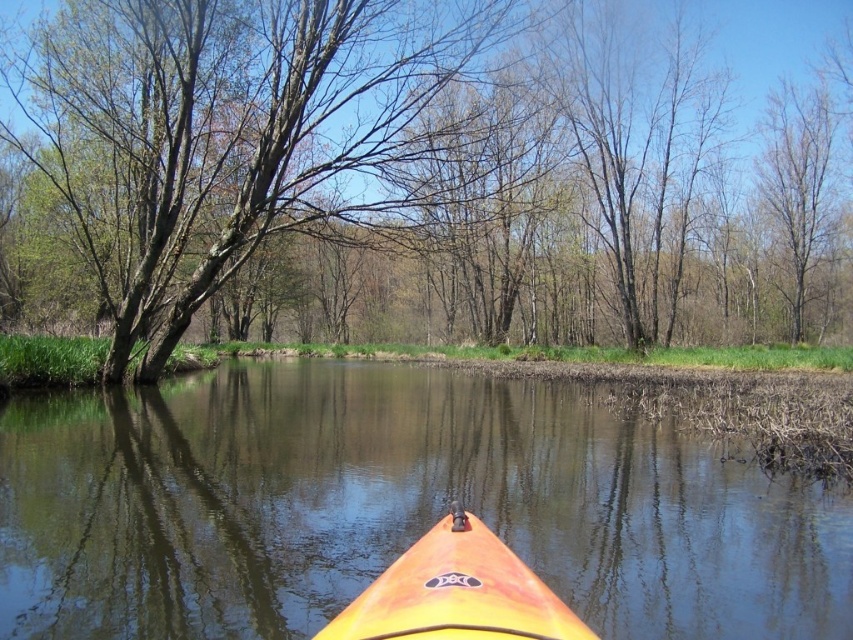
You are in a kayak and want to paddle through a narrow section of the river. The narrow section is just wide enough to fit the orange plastic kayak at center. Can the brown bark tree at center also fit through this narrow section?

The brown bark tree at center is wider than the orange plastic kayak at center, so it cannot fit through the narrow section of the river that is just wide enough for the kayak.

You are navigating a kayak on a calm river surrounded by a forest. You notice your orange plastic kayak at center is positioned at coordinates 0.792, 0.460. If you want to move straight forward, which direction should you paddle to stay centered on the river?

Since the orange plastic kayak at center is already positioned at coordinates (392, 506), you should continue paddling straight ahead to maintain your current position in the center of the river.

You are in a kayak on a calm river surrounded by a forest. You notice two kayaks in front of you. Which one is positioned lower in the water? The orange plastic kayak at center and the orange matte kayak at center.

The orange plastic kayak at center is positioned lower in the water than the orange matte kayak at center because it is described as being below it.